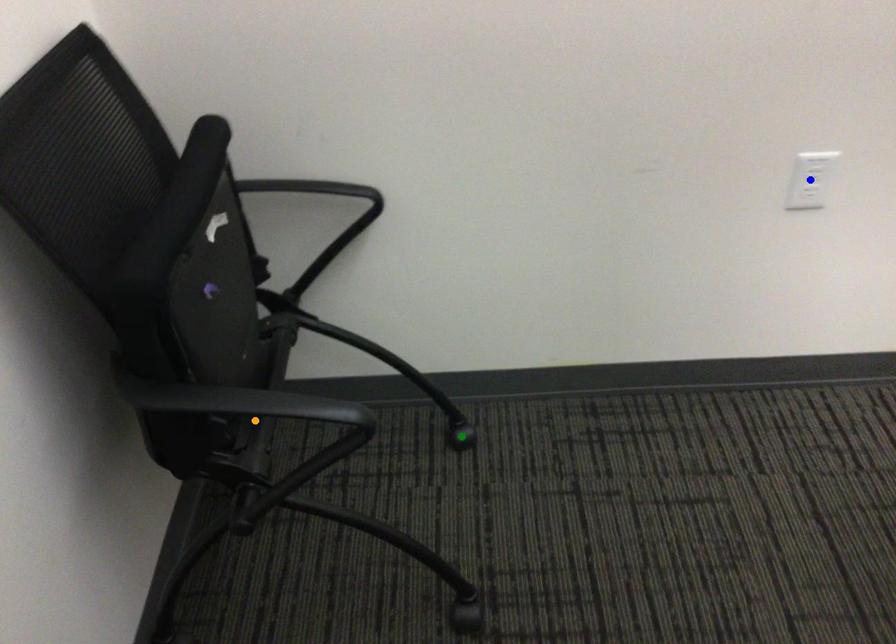
Order these from nearest to farthest:
1. blue point
2. green point
3. orange point

orange point
blue point
green point